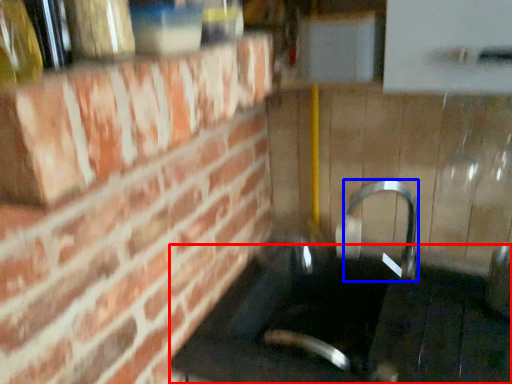
Question: Among these objects, which one is farthest to the camera, counter top (highlighted by a red box) or faucet (highlighted by a blue box)?

Choices:
 (A) counter top
 (B) faucet

Answer: (B)